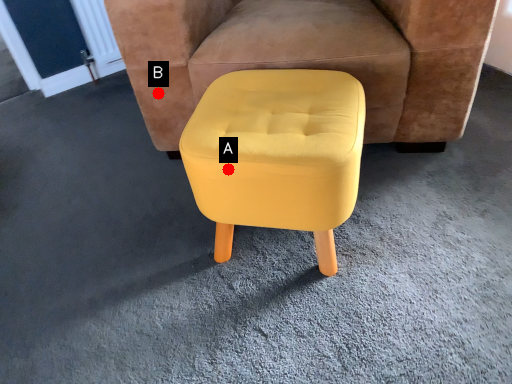
Question: Two points are circled on the image, labeled by A and B beside each circle. Which point appears closest to the camera in this image?

Choices:
 (A) A is closer
 (B) B is closer

Answer: (A)